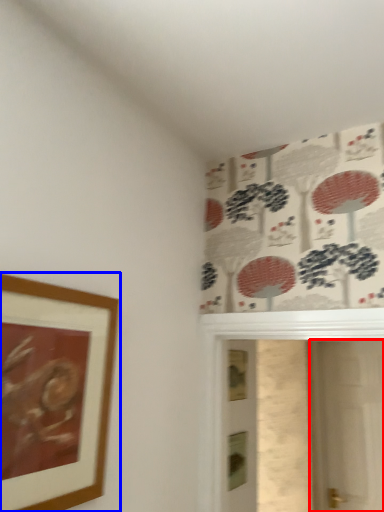
Question: Which object is closer to the camera taking this photo, screen door (highlighted by a red box) or picture frame (highlighted by a blue box)?

Choices:
 (A) screen door
 (B) picture frame

Answer: (B)